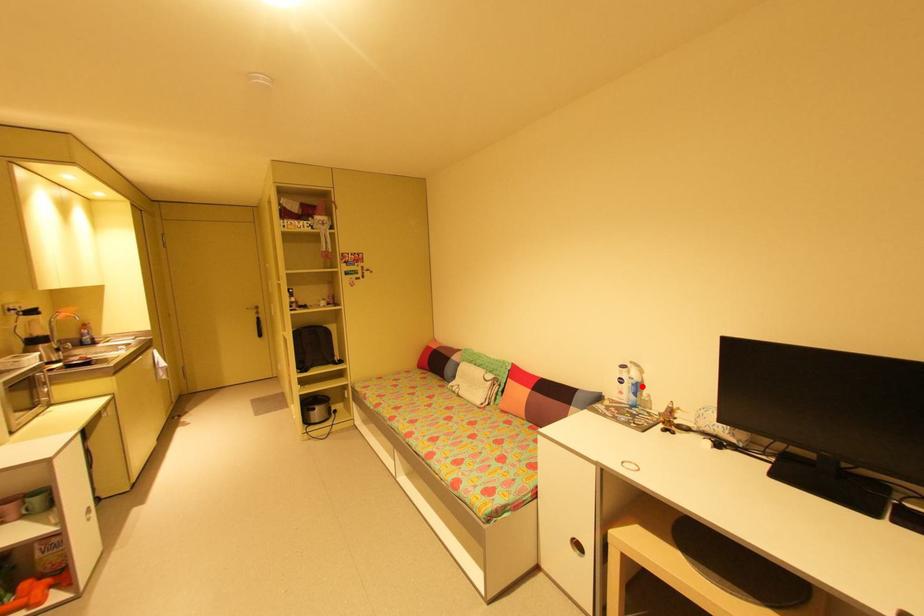
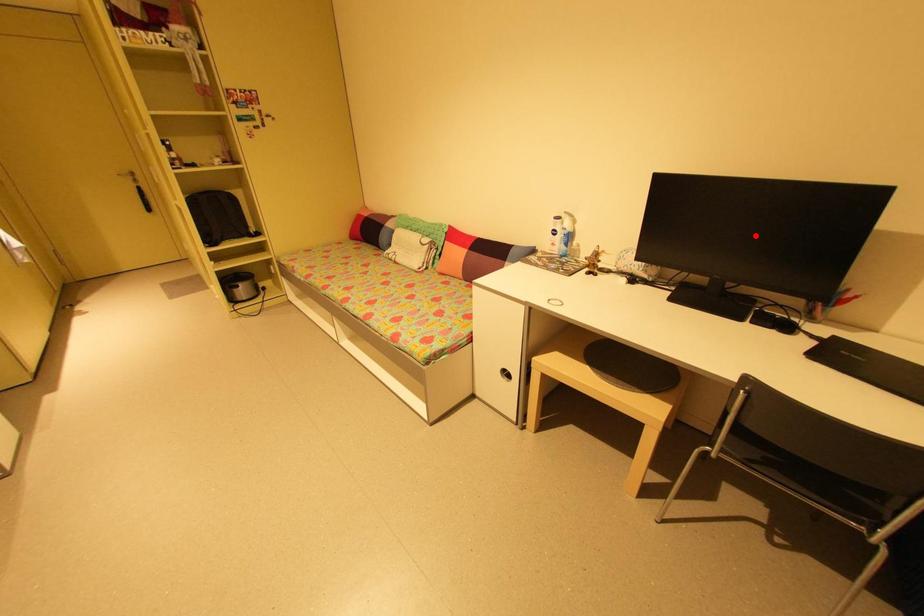
I am providing you with two images of the same scene from different viewpoints. A red point is marked on the first image and another point is marked on the second image. Is the marked point in image1 the same physical position as the marked point in image2?

No